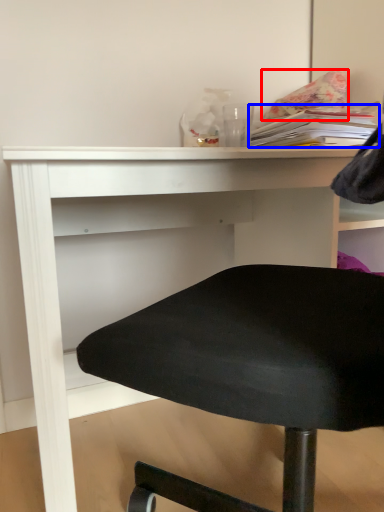
Question: Which object is closer to the camera taking this photo, pillow (highlighted by a red box) or book (highlighted by a blue box)?

Choices:
 (A) pillow
 (B) book

Answer: (B)